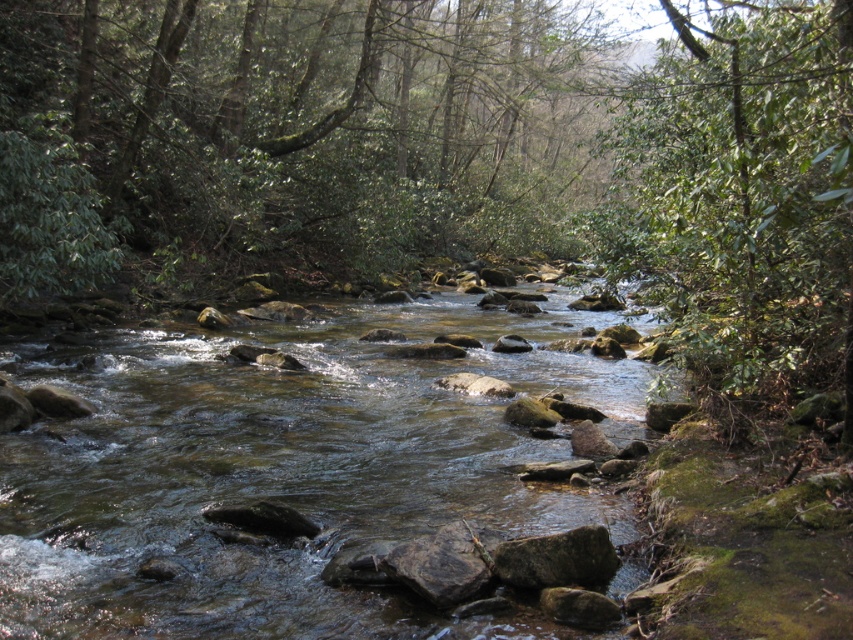
You are a hiker trying to cross the stream. You see the clear water at center and the green leafy tree at upper center. Which object is closer to you as you stand on the bank?

The green leafy tree at upper center is closer to you because the clear water at center is behind it.

Looking at this image, you are a hiker trying to navigate through the forest. You notice two trees ahead of you, the green leafy tree at upper center and the green leafy tree at upper right. Which tree should you approach if you want to find a larger tree to rest under?

The green leafy tree at upper center is larger in size compared to the green leafy tree at upper right, so you should approach the green leafy tree at upper center to rest under.

You are planning to cross the stream using a small wooden bridge that is 1.2 meters wide. The bridge is positioned between the clear water at center and the green leafy tree at upper right. Can the bridge fit across the stream without touching the water?

The clear water at center might be wider than green leafy tree at upper right. Since the bridge is 1.2 meters wide, it depends on the actual width of the stream. If the stream at the clear water at center is wider than 1.2 meters, the bridge can fit without touching the water. If it is narrower, the bridge would extend beyond the stream, but since the description is uncertain, we cannot confirm for sure.